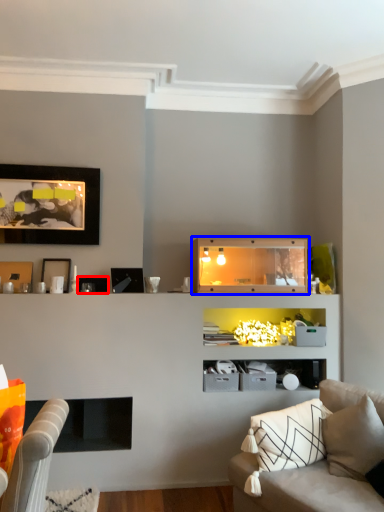
Question: Among these objects, which one is farthest to the camera, picture frame (highlighted by a red box) or shelf (highlighted by a blue box)?

Choices:
 (A) picture frame
 (B) shelf

Answer: (A)